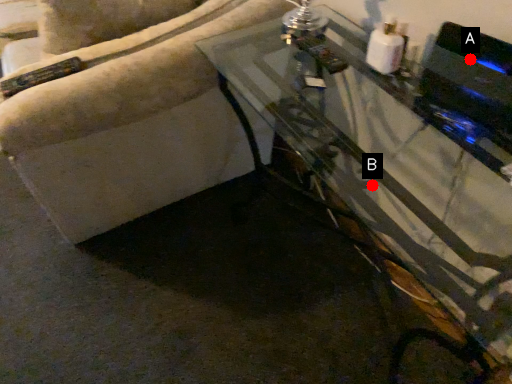
Question: Two points are circled on the image, labeled by A and B beside each circle. Which point is closer to the camera?

Choices:
 (A) A is closer
 (B) B is closer

Answer: (B)